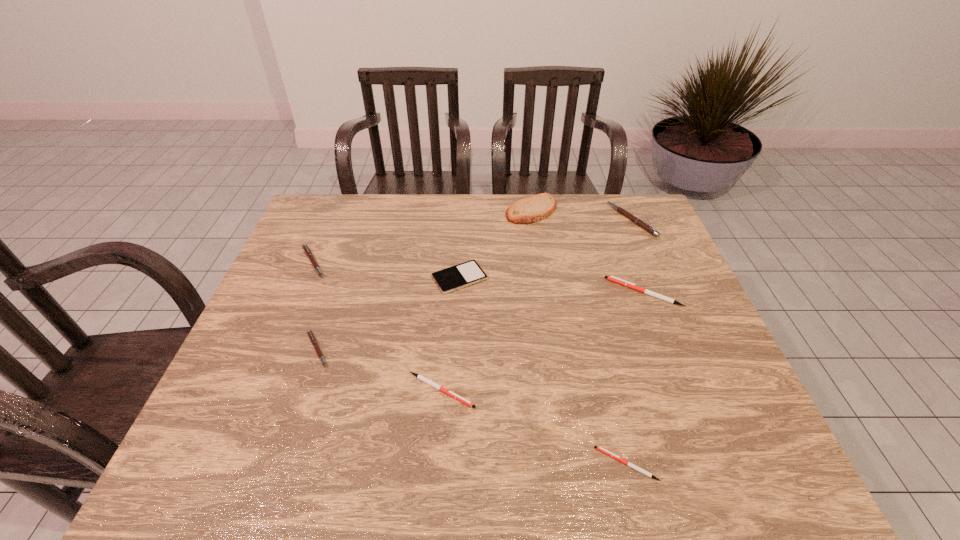
Identify the location of free space between the shortest object and the farthest pink pen. The height and width of the screenshot is (540, 960). (629, 342).

Image resolution: width=960 pixels, height=540 pixels. In order to click on vacant point located between the fourth farthest pen and the pita bread in this screenshot , I will do `click(424, 280)`.

Identify the location of free space between the shortest object and the second tallest object. [x=629, y=342].

In order to click on free space that is in between the gray iPod and the pita bread in this screenshot , I will do 495,245.

You are a GUI agent. You are given a task and a screenshot of the screen. Output one action in this format:
    pyautogui.click(x=<x>, y=<y>)
    Task: Click on the free spot between the seventh farthest object and the tallest pen
    The width and height of the screenshot is (960, 540).
    Given the screenshot: What is the action you would take?
    pyautogui.click(x=537, y=305)

I want to click on free space between the biggest white pen and the pita bread, so click(x=588, y=251).

I want to click on object identified as the second closest to the gray iPod, so [420, 377].

Choose which object is the second nearest neighbor to the farthest white pen. Please provide its 2D coordinates. Your answer should be formatted as a tuple, i.e. [(x, y)], where the tuple contains the x and y coordinates of a point satisfying the conditions above.

[(534, 208)]

Choose which pen is the fourth nearest neighbor to the iPod. Please provide its 2D coordinates. Your answer should be formatted as a tuple, i.e. [(x, y)], where the tuple contains the x and y coordinates of a point satisfying the conditions above.

[(614, 279)]

Where is `pen that can be found as the fourth closest to the second farthest pink pen`? pen that can be found as the fourth closest to the second farthest pink pen is located at coordinates (601, 449).